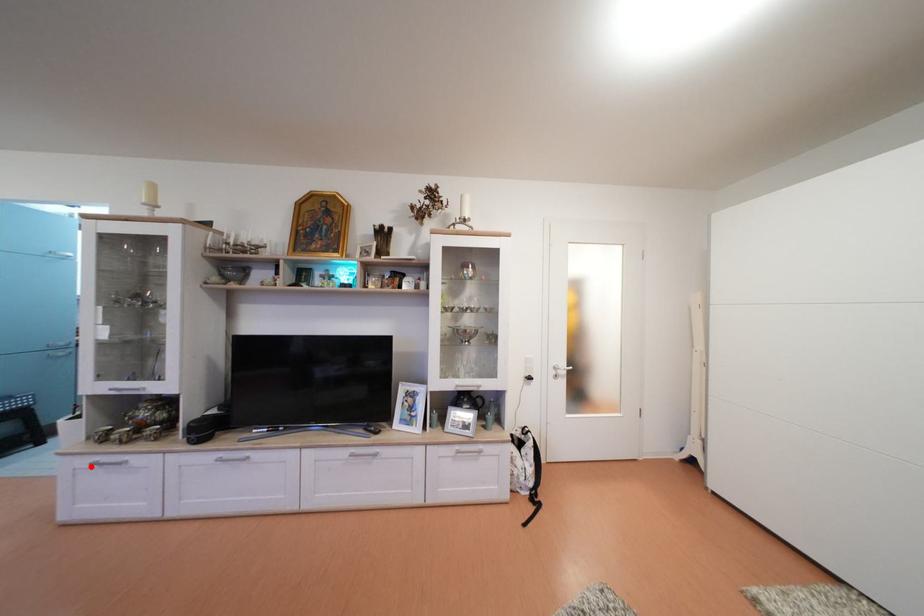
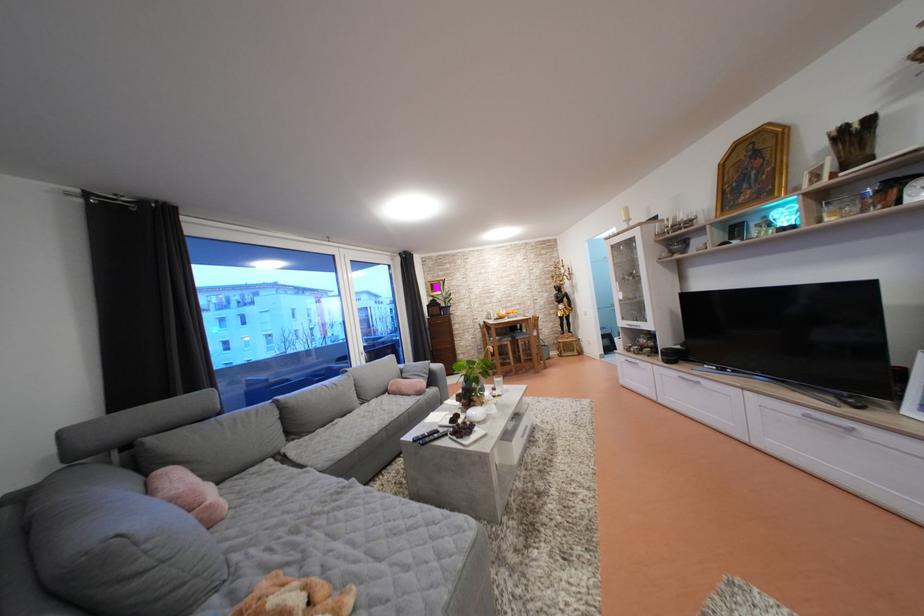
Question: I am providing you with two images of the same scene from different viewpoints. In image1, a red point is highlighted. Considering the same 3D point in image2, which of the following is correct?

Choices:
 (A) It is closer
 (B) It is farther

Answer: (B)